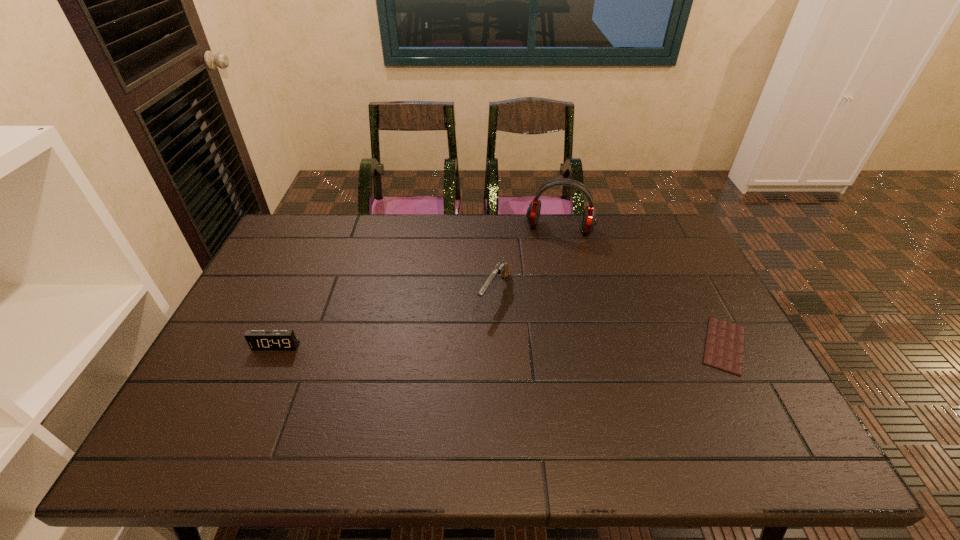
The image size is (960, 540). I want to click on vacant space located aiming along the barrel of the second farthest object, so click(460, 361).

Where is `vacant area situated 0.160m aiming along the barrel of the second farthest object`? The image size is (960, 540). vacant area situated 0.160m aiming along the barrel of the second farthest object is located at coordinates (463, 356).

Locate an element on the screen. This screenshot has height=540, width=960. vacant space located aiming along the barrel of the second farthest object is located at coordinates (445, 385).

Identify the location of vacant space situated on the ear cups of the farthest object. (544, 300).

At what (x,y) coordinates should I click in order to perform the action: click on free spot located on the ear cups of the farthest object. Please return your answer as a coordinate pair (x, y). Looking at the image, I should click on (546, 291).

This screenshot has height=540, width=960. I want to click on free space located 0.350m on the ear cups of the farthest object, so click(542, 313).

The height and width of the screenshot is (540, 960). I want to click on object at the far edge, so click(x=589, y=221).

The height and width of the screenshot is (540, 960). I want to click on object situated at the left edge, so click(257, 339).

Find the location of `object located at the right edge`. object located at the right edge is located at coordinates (724, 344).

You are a GUI agent. You are given a task and a screenshot of the screen. Output one action in this format:
    pyautogui.click(x=<x>, y=<y>)
    Task: Click on the free space at the far edge
    The height and width of the screenshot is (540, 960).
    Given the screenshot: What is the action you would take?
    pyautogui.click(x=516, y=247)